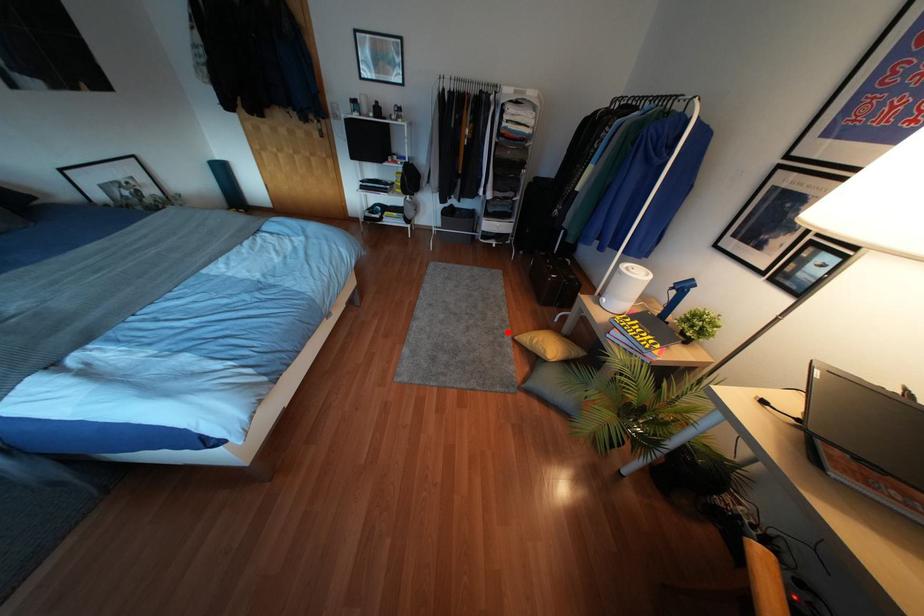
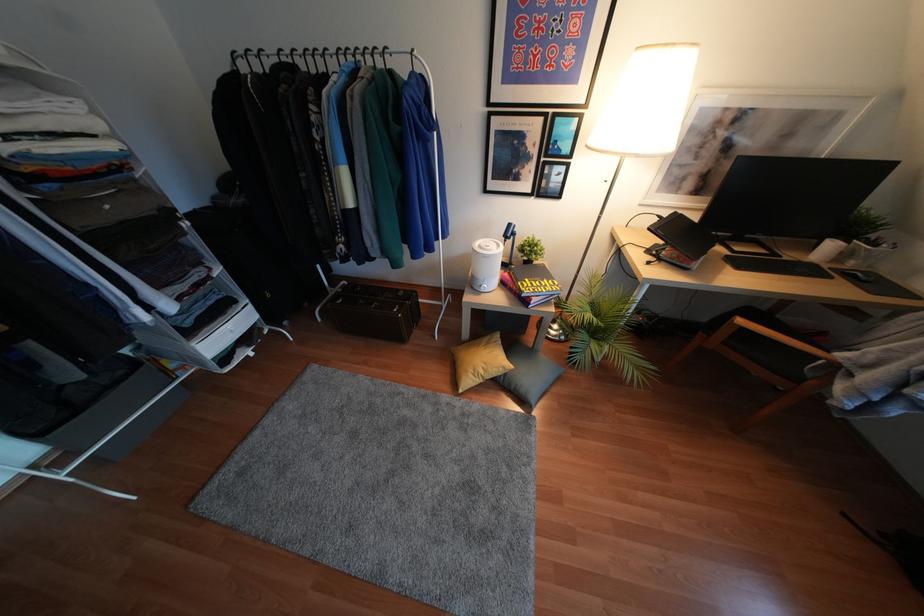
Question: I am providing you with two images of the same scene from different viewpoints. Image1 has a red point marked. In image2, the corresponding 3D location appears at what relative position? Reply with the corresponding letter.

Choices:
 (A) Closer
 (B) Farther

Answer: (A)